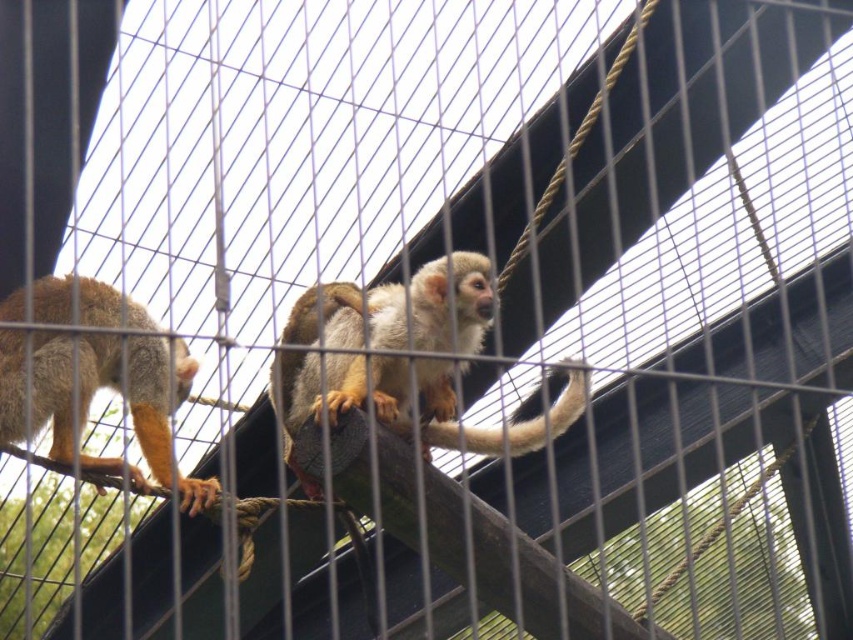
Is golden fur monkey at center bigger than brown fur monkey at left?

Indeed, golden fur monkey at center has a larger size compared to brown fur monkey at left.

Is golden fur monkey at center closer to the viewer compared to brown fur monkey at left?

Yes, it is in front of brown fur monkey at left.

Is point (525, 440) in front of point (49, 401)?

That is True.

This screenshot has width=853, height=640. I want to click on golden fur monkey at center, so click(x=456, y=301).

Is golden fur monkey at center above fuzzy brown tail at center?

Indeed, golden fur monkey at center is positioned over fuzzy brown tail at center.

Can you confirm if golden fur monkey at center is positioned to the left of fuzzy brown tail at center?

Yes, golden fur monkey at center is to the left of fuzzy brown tail at center.

Where is `golden fur monkey at center`? golden fur monkey at center is located at coordinates (456, 301).

I want to click on golden fur monkey at center, so click(456, 301).

Between brown fur monkey at left and fuzzy brown tail at center, which one is positioned higher?

fuzzy brown tail at center is above.

Is brown fur monkey at left taller than fuzzy brown tail at center?

Correct, brown fur monkey at left is much taller as fuzzy brown tail at center.

Which is behind, point (148, 372) or point (410, 429)?

The point (148, 372) is behind.

Find the location of a particular element. The height and width of the screenshot is (640, 853). brown fur monkey at left is located at coordinates (155, 396).